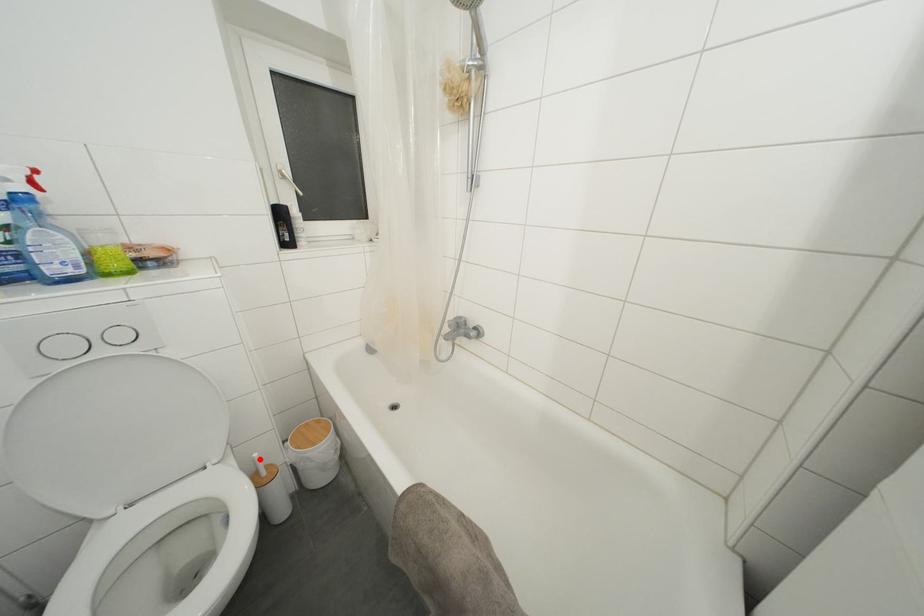
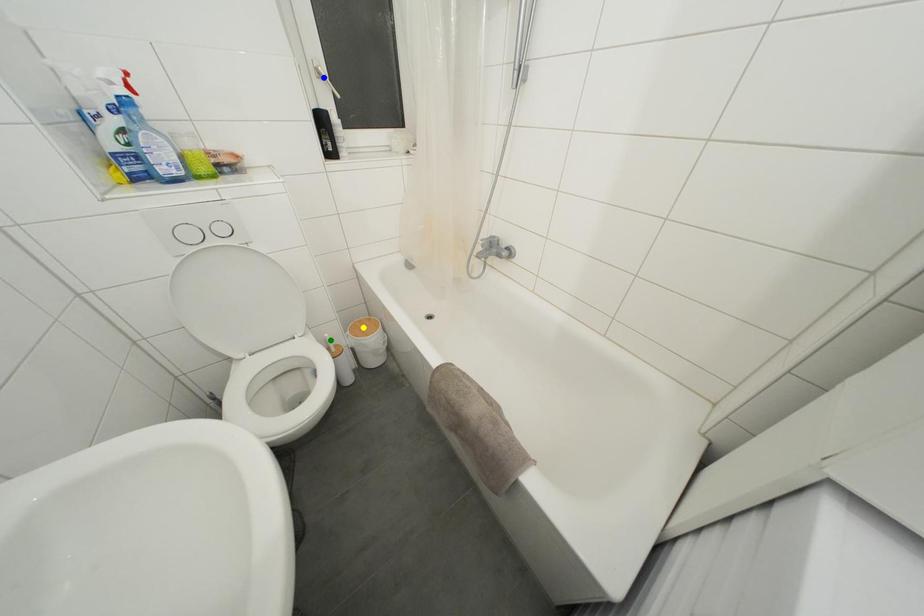
Question: I am providing you with two images of the same scene from different viewpoints. A red point is marked on the first image. You are given multiple points on the second image. Which mark in image 2 goes with the point in image 1?

Choices:
 (A) yellow point
 (B) green point
 (C) blue point

Answer: (B)